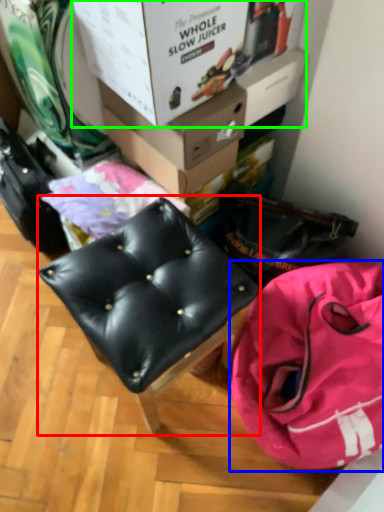
Question: Which object is positioned closest to furniture (highlighted by a red box)? Select from handbag (highlighted by a blue box) and box (highlighted by a green box).

Choices:
 (A) handbag
 (B) box

Answer: (A)